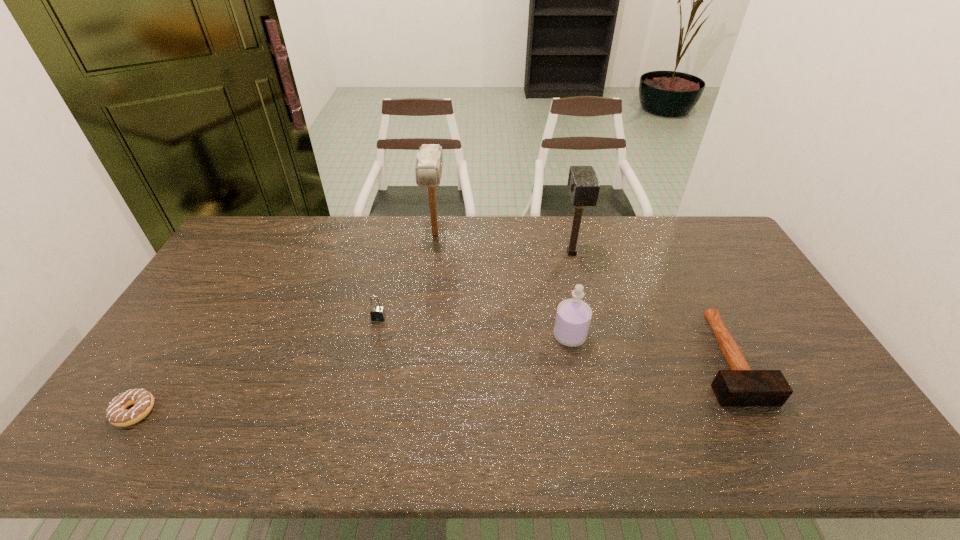
At what (x,y) coordinates should I click in order to perform the action: click on the third object from left to right. Please return your answer as a coordinate pair (x, y). Image resolution: width=960 pixels, height=540 pixels. Looking at the image, I should click on (428, 170).

Find the location of a particular element. Image resolution: width=960 pixels, height=540 pixels. the second mallet from right to left is located at coordinates (583, 185).

Where is `the third tallest object`? The width and height of the screenshot is (960, 540). the third tallest object is located at coordinates (573, 317).

At what (x,y) coordinates should I click in order to perform the action: click on the fourth tallest object. Please return your answer as a coordinate pair (x, y). Looking at the image, I should click on (377, 313).

Locate an element on the screen. the second object from left to right is located at coordinates (377, 313).

Identify the location of the rightmost mallet. tap(740, 386).

Where is `the rightmost object`? Image resolution: width=960 pixels, height=540 pixels. the rightmost object is located at coordinates (740, 386).

This screenshot has height=540, width=960. Identify the location of the leftmost object. (117, 413).

This screenshot has width=960, height=540. Identify the location of the shortest object. (117, 413).

Identify the location of free space located on the striking face of the leftmost mallet. The height and width of the screenshot is (540, 960). (424, 322).